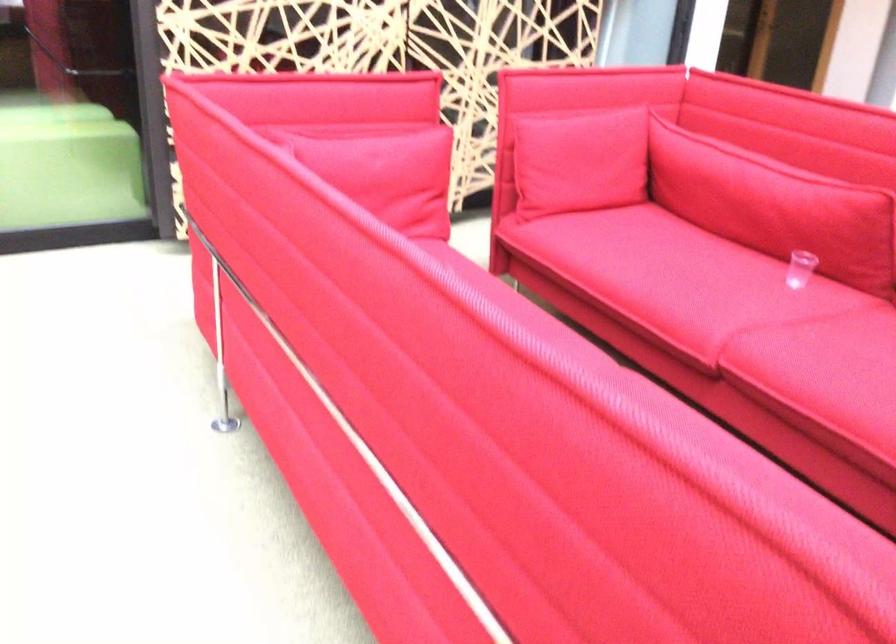
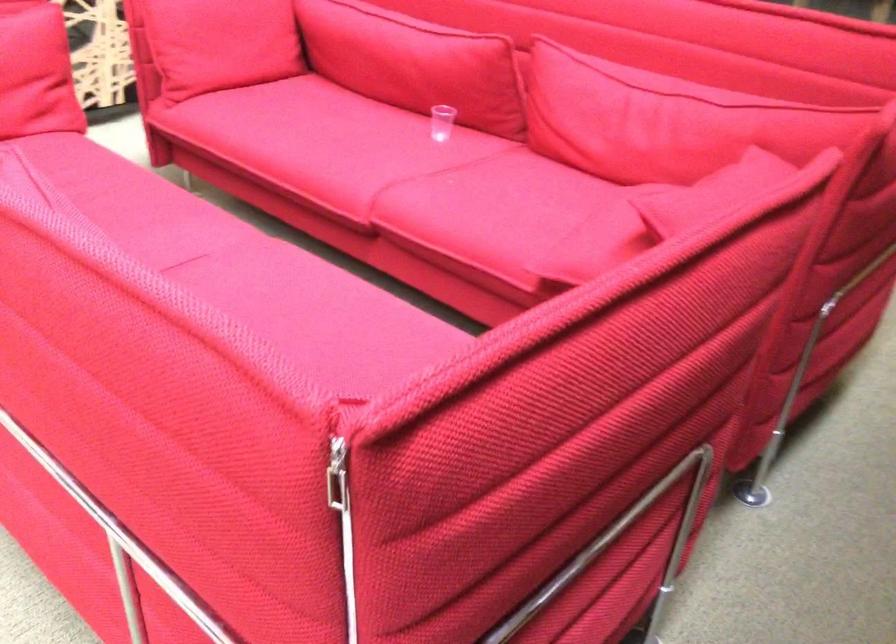
Find the pixel in the second image that matches the point at 570,169 in the first image.

(220, 43)